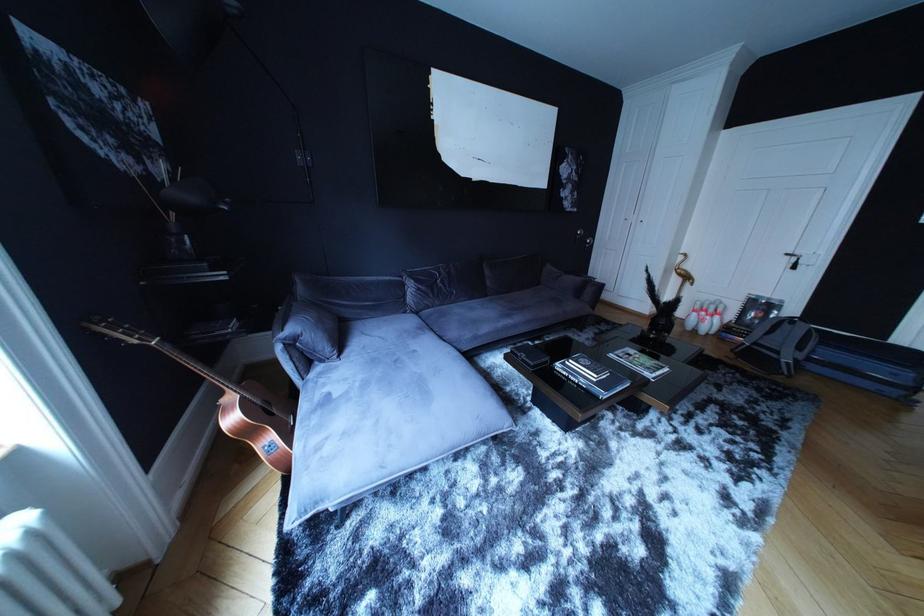
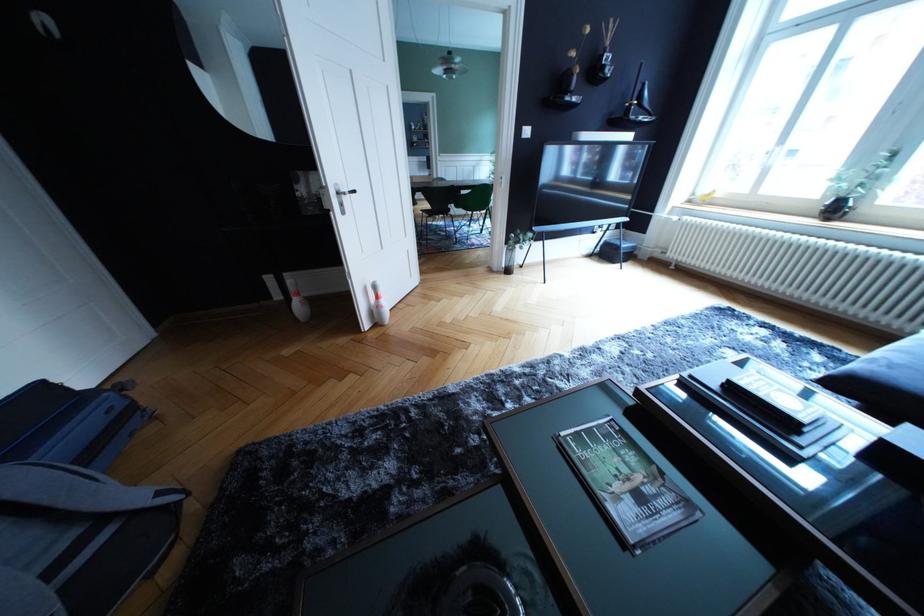
Where in the second image is the point corresponding to (638,361) from the first image?

(649, 504)